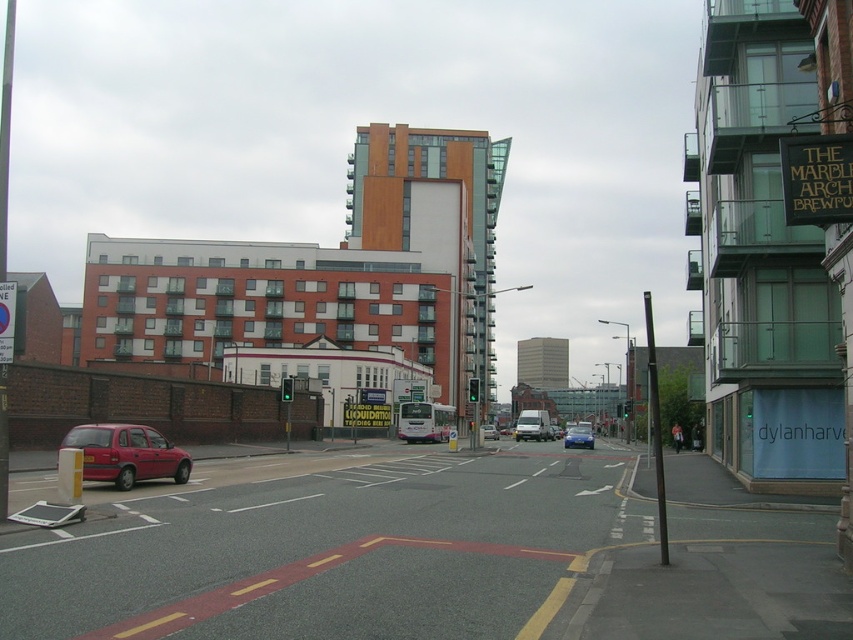
Is point (170, 445) closer to camera compared to point (589, 438)?

Yes, it is in front of point (589, 438).

Which is behind, point (91, 426) or point (564, 445)?

The point (564, 445) is more distant.

You are a GUI agent. You are given a task and a screenshot of the screen. Output one action in this format:
    pyautogui.click(x=<x>, y=<y>)
    Task: Click on the matte red car at lower left
    The image size is (853, 640).
    Given the screenshot: What is the action you would take?
    click(126, 452)

Between point (157, 467) and point (492, 432), which one is positioned in front?

Point (157, 467) is in front.

Can you confirm if matte red car at lower left is smaller than matte red car at center?

Correct, matte red car at lower left occupies less space than matte red car at center.

This screenshot has height=640, width=853. What do you see at coordinates (126, 452) in the screenshot?
I see `matte red car at lower left` at bounding box center [126, 452].

Where is `matte red car at lower left`? matte red car at lower left is located at coordinates (126, 452).

Who is positioned more to the left, blue metallic sedan at center or matte red car at center?

matte red car at center is more to the left.

Based on the photo, is blue metallic sedan at center shorter than matte red car at center?

Indeed, blue metallic sedan at center has a lesser height compared to matte red car at center.

Who is more distant from viewer, (575, 432) or (492, 426)?

The point (492, 426) is behind.

Locate an element on the screen. This screenshot has height=640, width=853. blue metallic sedan at center is located at coordinates (578, 436).